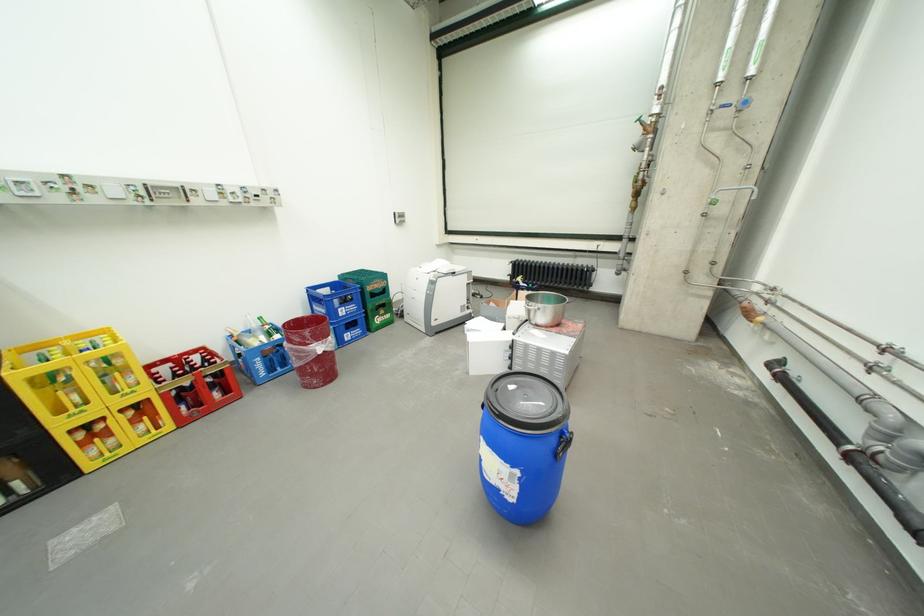
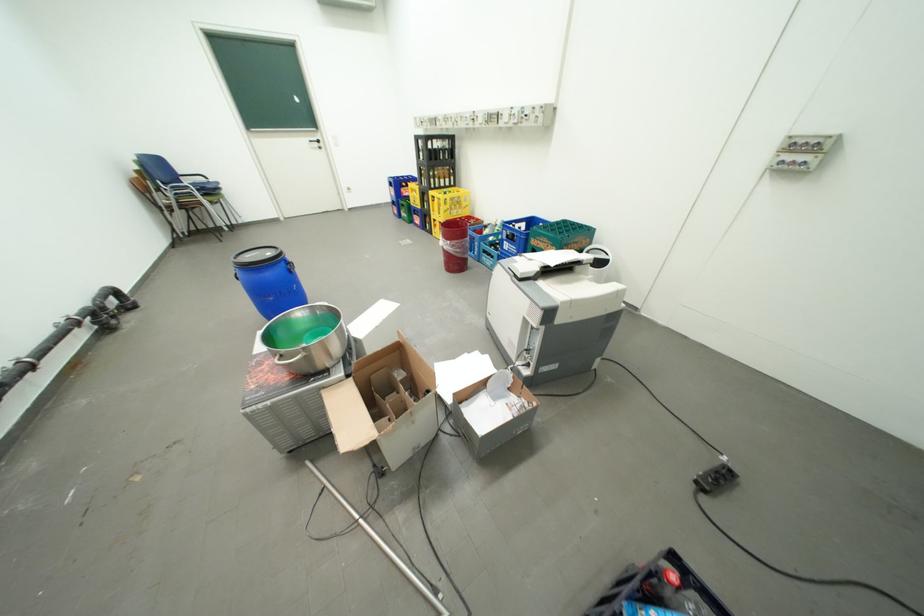
Locate, in the second image, the point that corresponds to (349,310) in the first image.

(516, 244)